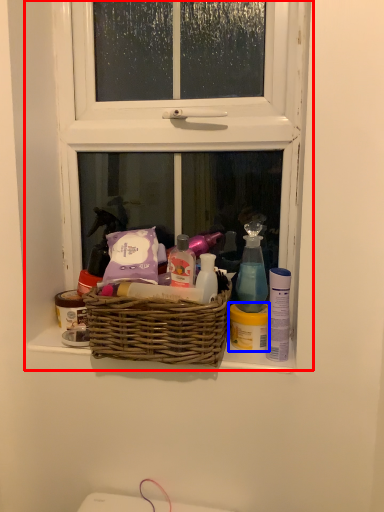
Question: Which point is closer to the camera, window (highlighted by a red box) or toiletry (highlighted by a blue box)?

Choices:
 (A) window
 (B) toiletry

Answer: (A)